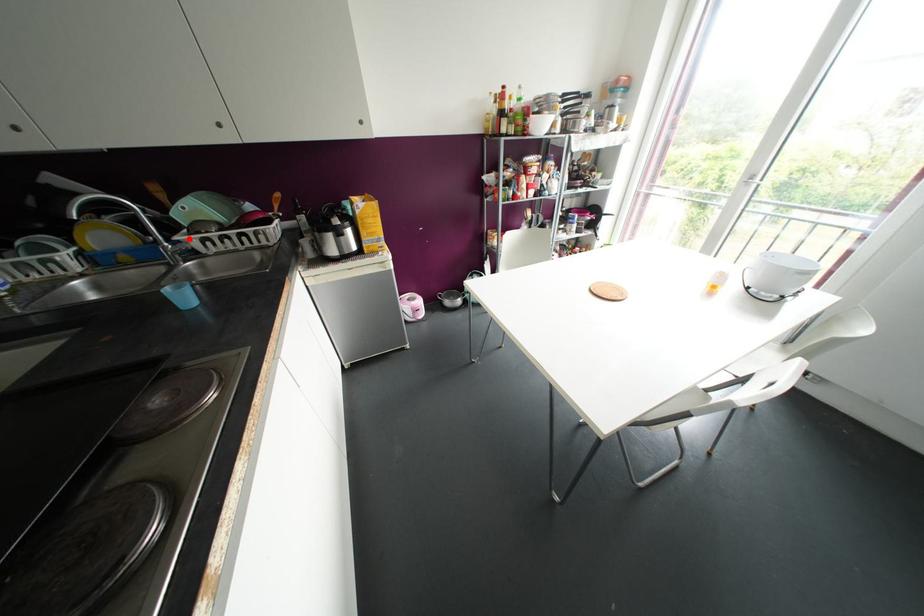
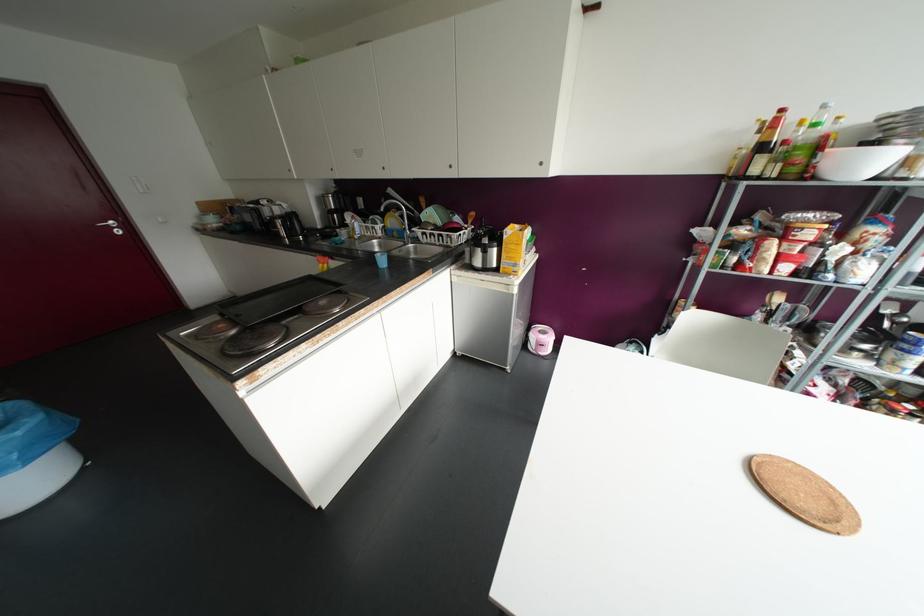
Where in the second image is the point corresponding to the highlighted location from the first image?

(417, 231)